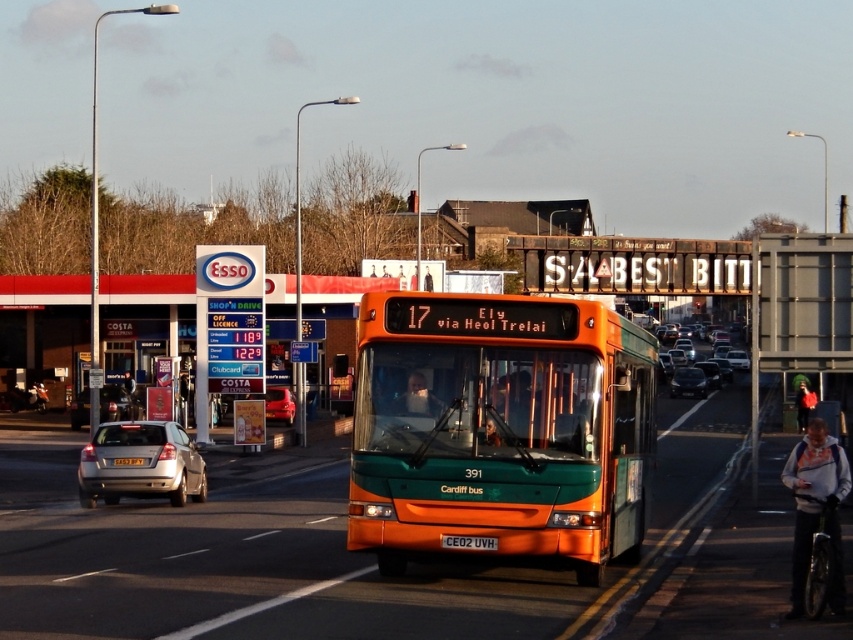
This screenshot has height=640, width=853. What are the coordinates of `metallic red car at center` in the screenshot? It's located at (279, 404).

Can you confirm if metallic red car at center is shorter than metallic silver sedan at center?

Correct, metallic red car at center is not as tall as metallic silver sedan at center.

Is point (279, 412) positioned in front of point (692, 369)?

Yes, it is in front of point (692, 369).

The height and width of the screenshot is (640, 853). What are the coordinates of `metallic red car at center` in the screenshot? It's located at (279, 404).

Does metallic silver sedan at center-right appear under metallic silver sedan at center?

Actually, metallic silver sedan at center-right is above metallic silver sedan at center.

Looking at this image, which of these two, metallic silver sedan at center-right or metallic silver sedan at center, stands taller?

Standing taller between the two is metallic silver sedan at center-right.

Identify the location of metallic silver sedan at center-right. The image size is (853, 640). (689, 365).

The height and width of the screenshot is (640, 853). Identify the location of metallic silver sedan at center-right. (689, 365).

Is metallic silver sedan at center-right below orange plastic license plate at center?

Actually, metallic silver sedan at center-right is above orange plastic license plate at center.

Can you confirm if metallic silver sedan at center-right is bigger than orange plastic license plate at center?

Yes.

The height and width of the screenshot is (640, 853). Identify the location of metallic silver sedan at center-right. (689, 365).